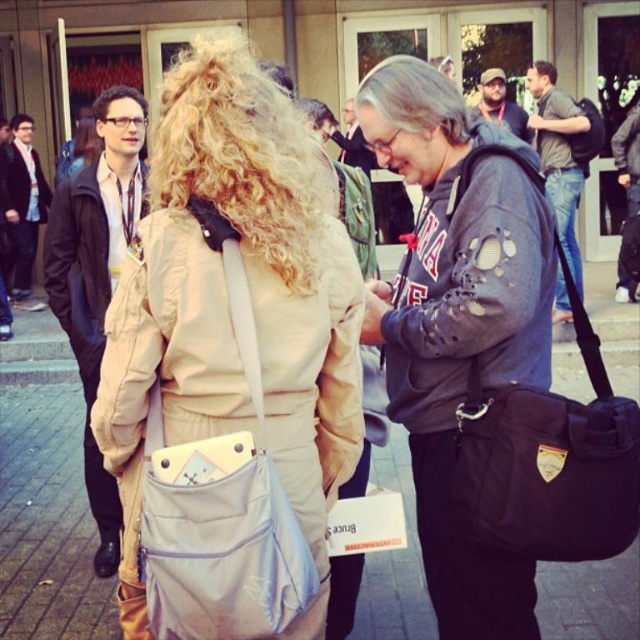
Question: Can you confirm if beige fabric coat at upper center is positioned above light blue fabric bag at center?

Choices:
 (A) no
 (B) yes

Answer: (B)

Question: Which point is farther to the camera?

Choices:
 (A) beige fabric coat at upper center
 (B) gray fabric bag at center
 (C) light blue fabric bag at center
 (D) beige fabric jacket at center

Answer: (B)

Question: Which object is farther from the camera taking this photo?

Choices:
 (A) gray fabric bag at center
 (B) beige fabric coat at upper center
 (C) black fabric bag at center
 (D) beige fabric jacket at center

Answer: (A)

Question: Which point is farther to the camera?

Choices:
 (A) (48, 561)
 (B) (236, 448)
 (C) (602, 536)
 (D) (209, 403)

Answer: (A)

Question: Does beige fabric jacket at center appear on the right side of light blue fabric bag at center?

Choices:
 (A) yes
 (B) no

Answer: (A)

Question: Can you confirm if light blue fabric bag at center is positioned above black fabric bag at center?

Choices:
 (A) yes
 (B) no

Answer: (B)